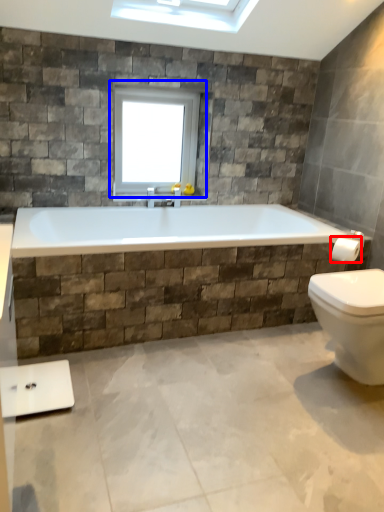
Question: Which object appears closest to the camera in this image, towel bar (highlighted by a red box) or window (highlighted by a blue box)?

Choices:
 (A) towel bar
 (B) window

Answer: (A)